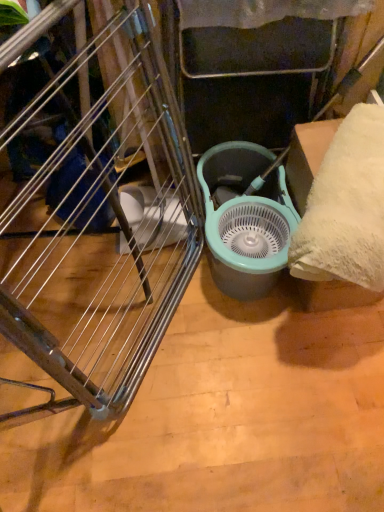
What do you see at coordinates (94, 223) in the screenshot? The image size is (384, 512). I see `brushed metal drying rack at left` at bounding box center [94, 223].

At what (x,y) coordinates should I click in order to perform the action: click on brushed metal drying rack at left. Please return your answer as a coordinate pair (x, y). The height and width of the screenshot is (512, 384). Looking at the image, I should click on (94, 223).

Describe the element at coordinates (245, 219) in the screenshot. I see `teal plastic mechanical fan at center` at that location.

Locate an element on the screen. teal plastic mechanical fan at center is located at coordinates (245, 219).

The image size is (384, 512). In order to click on brushed metal drying rack at left in this screenshot , I will do `click(94, 223)`.

Between brushed metal drying rack at left and teal plastic mechanical fan at center, which one appears on the right side from the viewer's perspective?

teal plastic mechanical fan at center.

From the picture: Is brushed metal drying rack at left closer to camera compared to teal plastic mechanical fan at center?

Yes, it is in front of teal plastic mechanical fan at center.

Does point (96, 154) come farther from viewer compared to point (217, 213)?

No, (96, 154) is closer to viewer.

From the image's perspective, is brushed metal drying rack at left below teal plastic mechanical fan at center?

Yes, from the image's perspective, brushed metal drying rack at left is below teal plastic mechanical fan at center.

From a real-world perspective, is brushed metal drying rack at left physically located above or below teal plastic mechanical fan at center?

brushed metal drying rack at left is above teal plastic mechanical fan at center.

Is brushed metal drying rack at left thinner than teal plastic mechanical fan at center?

Yes, brushed metal drying rack at left is thinner than teal plastic mechanical fan at center.

Who is shorter, brushed metal drying rack at left or teal plastic mechanical fan at center?

With less height is teal plastic mechanical fan at center.

Considering the relative sizes of brushed metal drying rack at left and teal plastic mechanical fan at center in the image provided, is brushed metal drying rack at left bigger than teal plastic mechanical fan at center?

Correct, brushed metal drying rack at left is larger in size than teal plastic mechanical fan at center.

Is teal plastic mechanical fan at center located within brushed metal drying rack at left?

No.

Is brushed metal drying rack at left next to teal plastic mechanical fan at center?

No, brushed metal drying rack at left is not with teal plastic mechanical fan at center.

Could you tell me if brushed metal drying rack at left is facing teal plastic mechanical fan at center?

Yes, brushed metal drying rack at left is turned towards teal plastic mechanical fan at center.

What are the coordinates of `mechanical fan above the brushed metal drying rack at left (from the image's perspective)` in the screenshot? It's located at (245, 219).

Considering the positions of objects teal plastic mechanical fan at center and brushed metal drying rack at left in the image provided, who is more to the right, teal plastic mechanical fan at center or brushed metal drying rack at left?

From the viewer's perspective, teal plastic mechanical fan at center appears more on the right side.

Does teal plastic mechanical fan at center lie behind brushed metal drying rack at left?

Yes, teal plastic mechanical fan at center is further from the viewer.

Between point (272, 237) and point (157, 219), which one is positioned in front?

Point (272, 237)

From the image's perspective, relative to brushed metal drying rack at left, is teal plastic mechanical fan at center above or below?

Based on their image positions, teal plastic mechanical fan at center is located above brushed metal drying rack at left.

From a real-world perspective, relative to brushed metal drying rack at left, is teal plastic mechanical fan at center vertically above or below?

Clearly, from a real-world perspective, teal plastic mechanical fan at center is below brushed metal drying rack at left.

Which of these two, teal plastic mechanical fan at center or brushed metal drying rack at left, is thinner?

brushed metal drying rack at left is thinner.

Is teal plastic mechanical fan at center taller than brushed metal drying rack at left?

In fact, teal plastic mechanical fan at center may be shorter than brushed metal drying rack at left.

Which of these two, teal plastic mechanical fan at center or brushed metal drying rack at left, is bigger?

brushed metal drying rack at left is bigger.

Is teal plastic mechanical fan at center positioned beyond the bounds of brushed metal drying rack at left?

Yes, teal plastic mechanical fan at center is outside of brushed metal drying rack at left.

Can you see teal plastic mechanical fan at center touching brushed metal drying rack at left?

No, teal plastic mechanical fan at center is not making contact with brushed metal drying rack at left.

In the scene shown: Is teal plastic mechanical fan at center turned away from brushed metal drying rack at left?

No, teal plastic mechanical fan at center is not facing the opposite direction of brushed metal drying rack at left.

Locate an element on the screen. The image size is (384, 512). furniture lying on the left of teal plastic mechanical fan at center is located at coordinates (94, 223).

The height and width of the screenshot is (512, 384). Find the location of `mechanical fan that appears behind the brushed metal drying rack at left`. mechanical fan that appears behind the brushed metal drying rack at left is located at coordinates (245, 219).

Identify the location of furniture in front of the teal plastic mechanical fan at center. (94, 223).